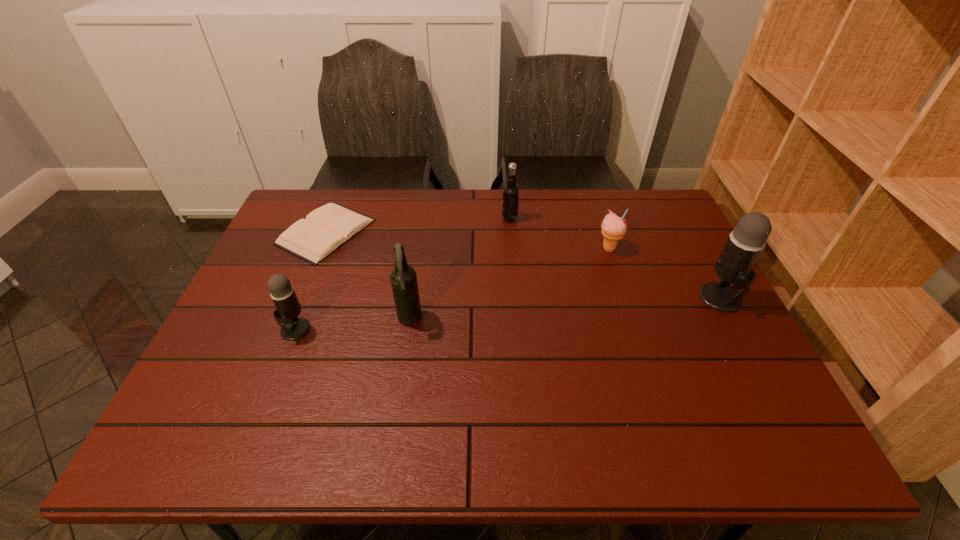
If the aim is uniform spacing by inserting an additional microphone among them, please point to a vacant space for this new microphone. Please provide its 2D coordinates. Your answer should be formatted as a tuple, i.e. [(x, y)], where the tuple contains the x and y coordinates of a point satisfying the conditions above.

[(516, 313)]